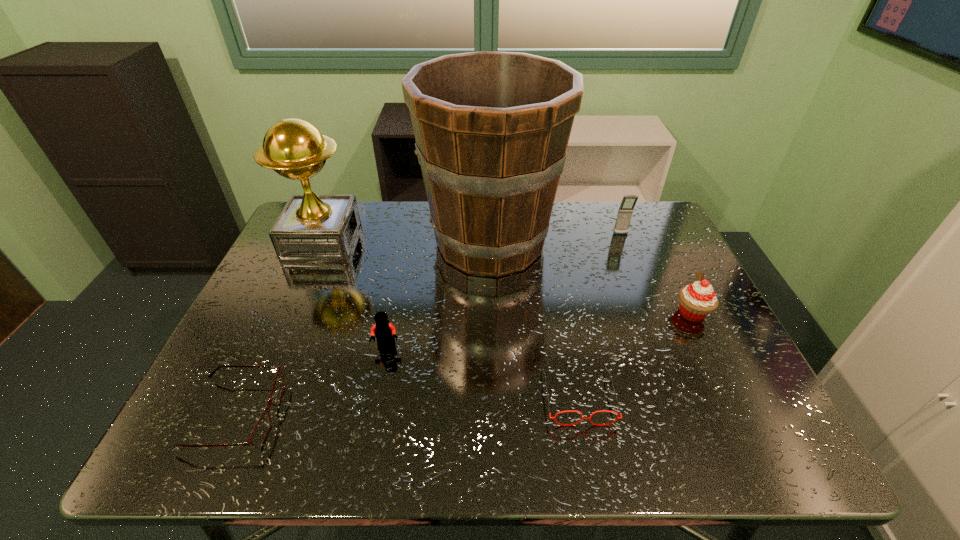
You are a GUI agent. You are given a task and a screenshot of the screen. Output one action in this format:
    pyautogui.click(x=<x>, y=<y>)
    Task: Click on the vacant area between the right spectacles and the cellular telephone
    This screenshot has height=540, width=960.
    Given the screenshot: What is the action you would take?
    pyautogui.click(x=600, y=315)

The width and height of the screenshot is (960, 540). In order to click on object that is the fourth closest to the rightmost object in this screenshot , I will do `click(384, 331)`.

Locate an element on the screen. The height and width of the screenshot is (540, 960). the third closest object to the right spectacles is located at coordinates (384, 331).

Locate an element on the screen. The width and height of the screenshot is (960, 540). blank space that satisfies the following two spatial constraints: 1. on the front-facing side of the cellular telephone; 2. on the lenses of the left spectacles is located at coordinates (692, 415).